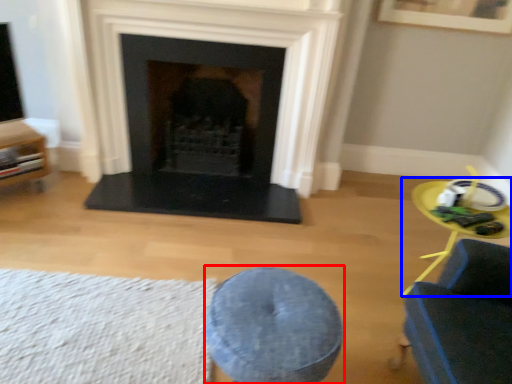
Question: Which point is further to the camera, bar stool (highlighted by a red box) or round table (highlighted by a blue box)?

Choices:
 (A) bar stool
 (B) round table

Answer: (B)